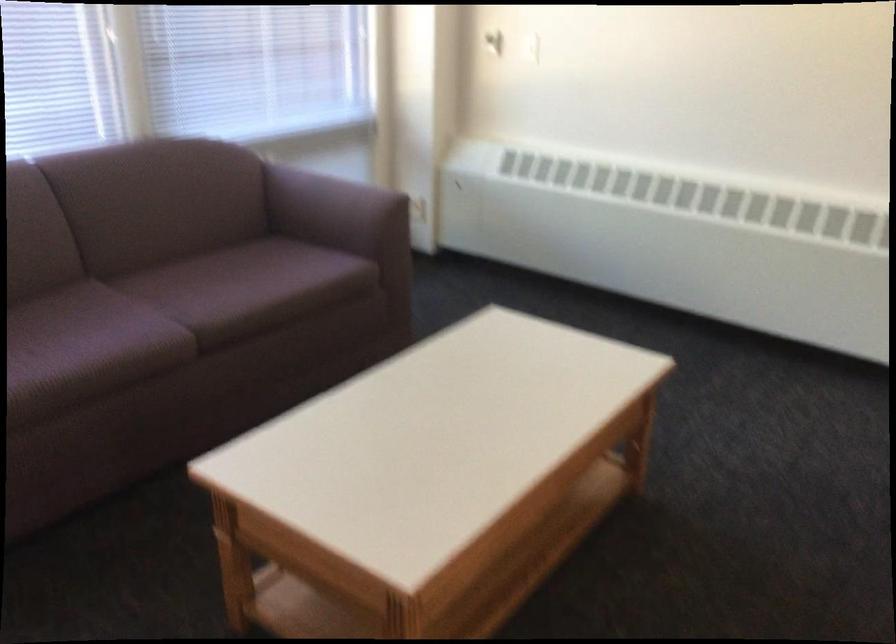
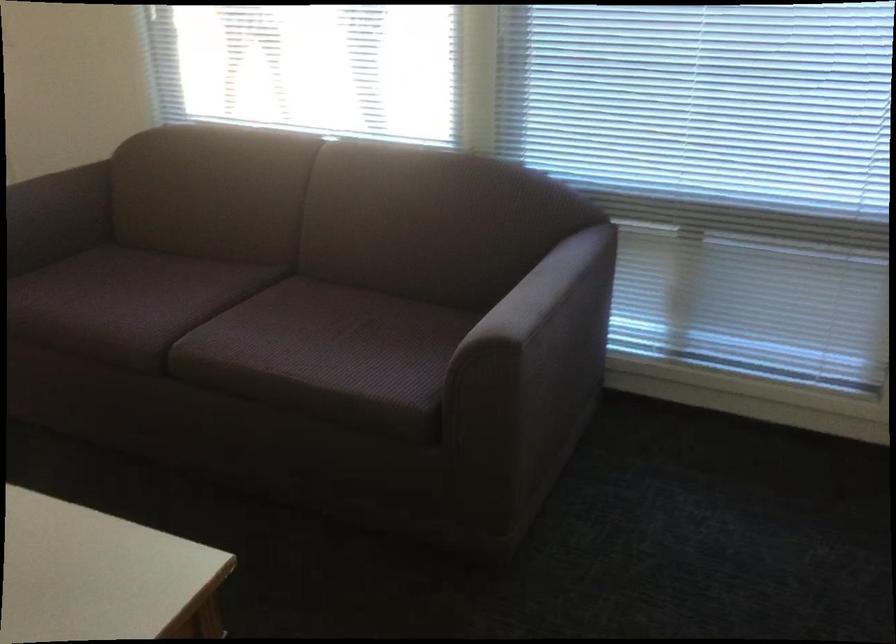
Locate, in the second image, the point that corresponds to (246,283) in the first image.

(325, 346)